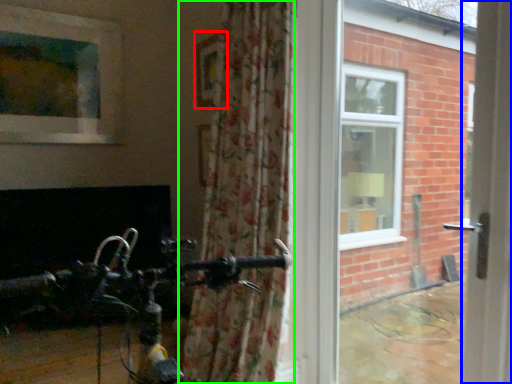
Question: Which object is positioned farthest from picture frame (highlighted by a red box)? Select from screen door (highlighted by a blue box) and curtain (highlighted by a green box).

Choices:
 (A) screen door
 (B) curtain

Answer: (A)